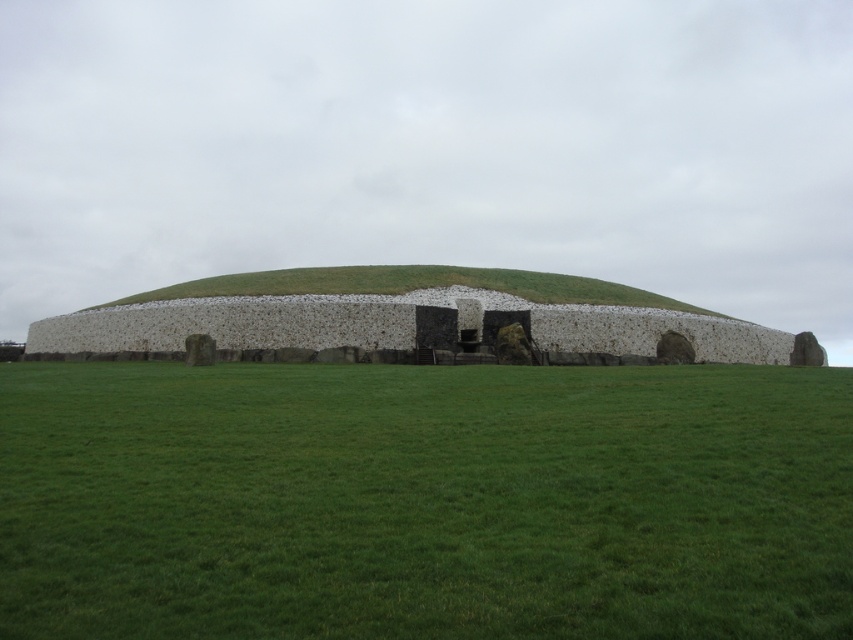
Question: Which object is closer to the camera taking this photo?

Choices:
 (A) green grassy mound at center
 (B) green grass at center

Answer: (B)

Question: Is green grass at center to the left of green grassy mound at center from the viewer's perspective?

Choices:
 (A) no
 (B) yes

Answer: (A)

Question: Is green grass at center to the left of green grassy mound at center from the viewer's perspective?

Choices:
 (A) no
 (B) yes

Answer: (A)

Question: Among these points, which one is nearest to the camera?

Choices:
 (A) (468, 280)
 (B) (242, 428)

Answer: (B)

Question: Can you confirm if green grass at center is wider than green grassy mound at center?

Choices:
 (A) yes
 (B) no

Answer: (B)

Question: Which object appears farthest from the camera in this image?

Choices:
 (A) green grassy mound at center
 (B) green grass at center

Answer: (A)